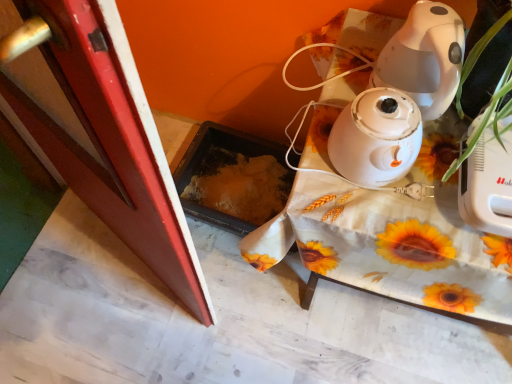
Question: From a real-world perspective, is smooth red screen door at left located higher than white glossy humidifier at center?

Choices:
 (A) no
 (B) yes

Answer: (A)

Question: Considering the relative sizes of smooth red screen door at left and white glossy humidifier at center in the image provided, is smooth red screen door at left thinner than white glossy humidifier at center?

Choices:
 (A) no
 (B) yes

Answer: (A)

Question: Can you confirm if smooth red screen door at left is taller than white glossy humidifier at center?

Choices:
 (A) no
 (B) yes

Answer: (B)

Question: Does smooth red screen door at left have a larger size compared to white glossy humidifier at center?

Choices:
 (A) no
 (B) yes

Answer: (B)

Question: Would you say white glossy humidifier at center is part of smooth red screen door at left's contents?

Choices:
 (A) yes
 (B) no

Answer: (B)

Question: Is point (495, 135) positioned closer to the camera than point (159, 206)?

Choices:
 (A) farther
 (B) closer

Answer: (A)

Question: Considering the positions of green leafy plant at right and smooth red screen door at left in the image, is green leafy plant at right taller or shorter than smooth red screen door at left?

Choices:
 (A) tall
 (B) short

Answer: (B)

Question: Is green leafy plant at right inside the boundaries of smooth red screen door at left, or outside?

Choices:
 (A) outside
 (B) inside

Answer: (A)

Question: Looking at the image, does green leafy plant at right seem bigger or smaller compared to smooth red screen door at left?

Choices:
 (A) small
 (B) big

Answer: (A)

Question: Is white glossy humidifier at center inside or outside of white fabric-covered table at upper right?

Choices:
 (A) outside
 (B) inside

Answer: (A)

Question: In terms of height, does white glossy humidifier at center look taller or shorter compared to white fabric-covered table at upper right?

Choices:
 (A) tall
 (B) short

Answer: (B)

Question: Considering the positions of white glossy humidifier at center and white fabric-covered table at upper right in the image, is white glossy humidifier at center bigger or smaller than white fabric-covered table at upper right?

Choices:
 (A) small
 (B) big

Answer: (A)

Question: Is point (368, 172) closer or farther from the camera than point (464, 291)?

Choices:
 (A) farther
 (B) closer

Answer: (B)

Question: Is green leafy plant at right bigger or smaller than white glossy humidifier at center?

Choices:
 (A) small
 (B) big

Answer: (B)

Question: Considering their positions, is green leafy plant at right located in front of or behind white glossy humidifier at center?

Choices:
 (A) behind
 (B) front

Answer: (B)